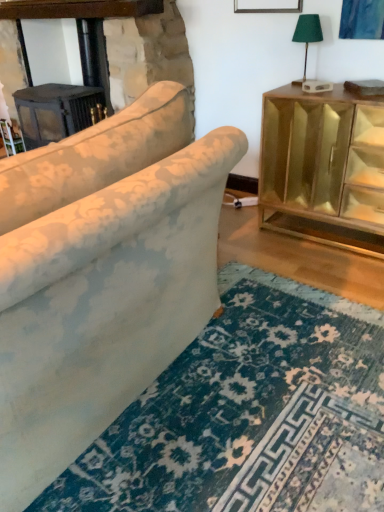
Where is `vacant space in front of gold mirrored cabinet at right`? The width and height of the screenshot is (384, 512). vacant space in front of gold mirrored cabinet at right is located at coordinates (329, 268).